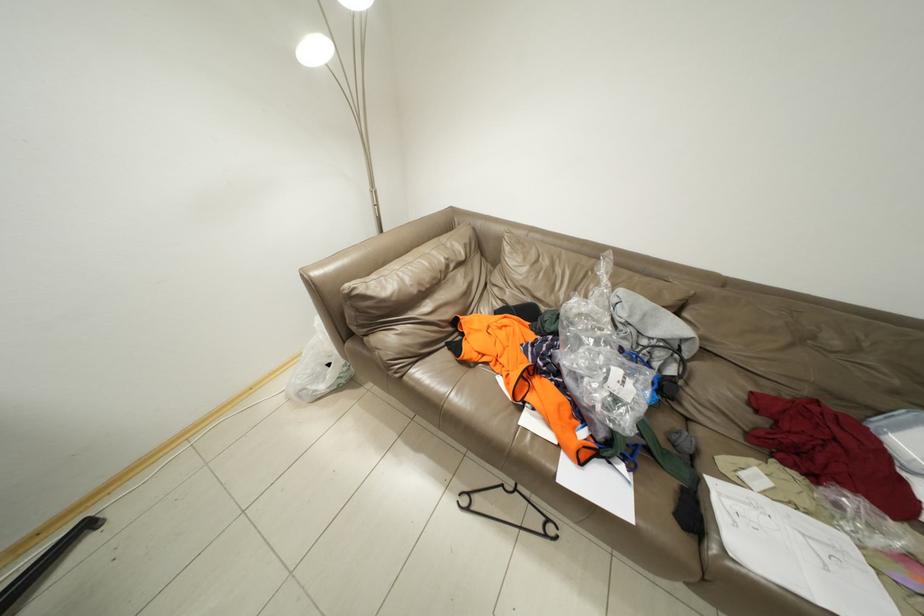
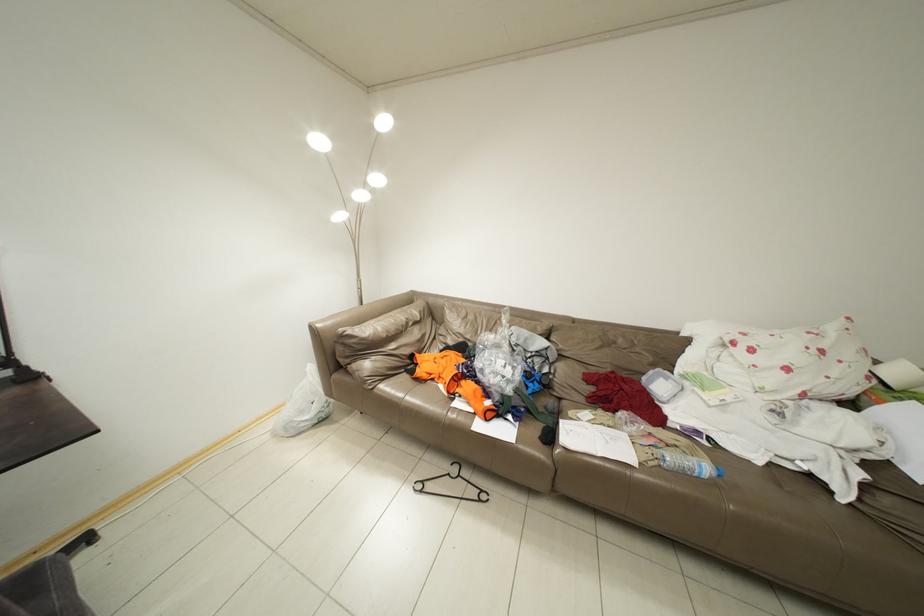
Question: In a continuous first-person perspective shot, in which direction is the camera moving?

Choices:
 (A) Left
 (B) Right
 (C) Forward
 (D) Backward

Answer: (D)